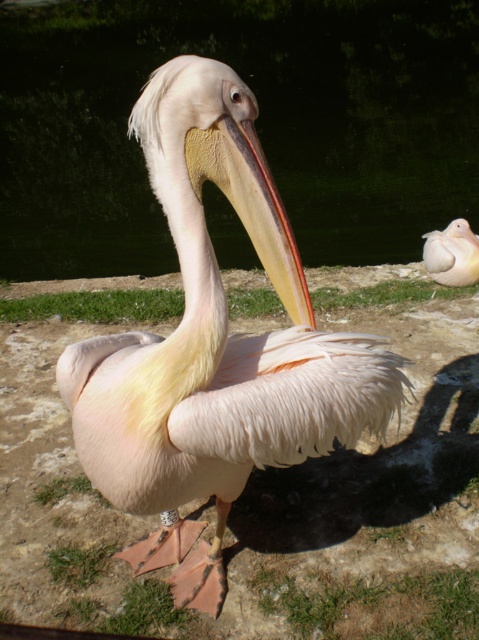
Does white feathered pelican at center appear over yellowish matte beak at center?

No, white feathered pelican at center is not above yellowish matte beak at center.

Is white feathered pelican at center wider than yellowish matte beak at center?

Yes, white feathered pelican at center is wider than yellowish matte beak at center.

The height and width of the screenshot is (640, 479). I want to click on white feathered pelican at center, so click(x=214, y=346).

Between transparent water at center and matte pink pelican at right, which one is positioned higher?

Positioned higher is transparent water at center.

Between transparent water at center and matte pink pelican at right, which one has less height?

With less height is matte pink pelican at right.

Describe the element at coordinates (257, 124) in the screenshot. I see `transparent water at center` at that location.

Where is `transparent water at center`? transparent water at center is located at coordinates (257, 124).

Does point (381, 125) lie behind point (164, 132)?

Yes, it is behind point (164, 132).

The height and width of the screenshot is (640, 479). I want to click on transparent water at center, so point(257,124).

Locate an element on the screen. This screenshot has height=640, width=479. transparent water at center is located at coordinates (257, 124).